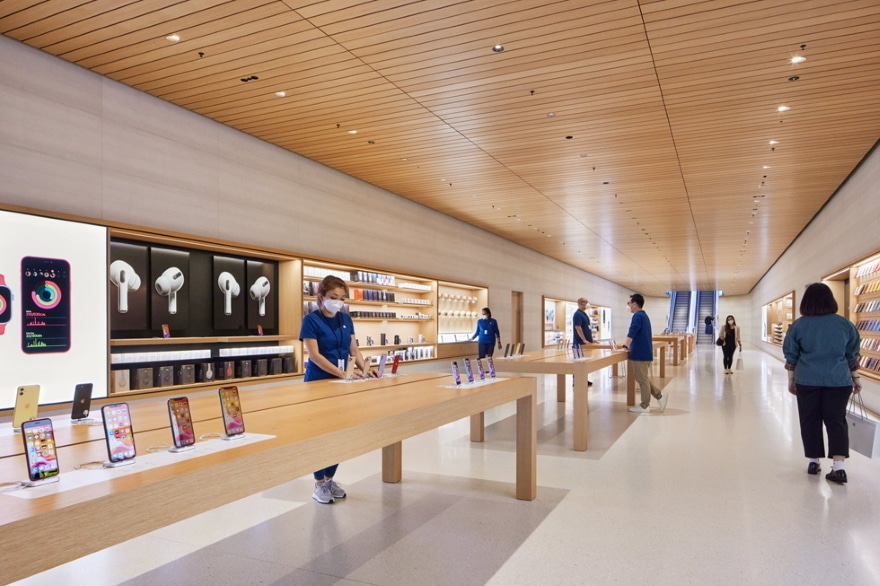
I want to click on ceiling lights, so click(495, 46).